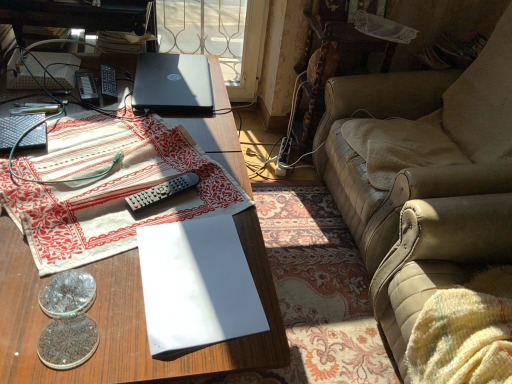
I want to click on free space between satin black laptop at upper center and white cotton tablecloth at left, so click(154, 119).